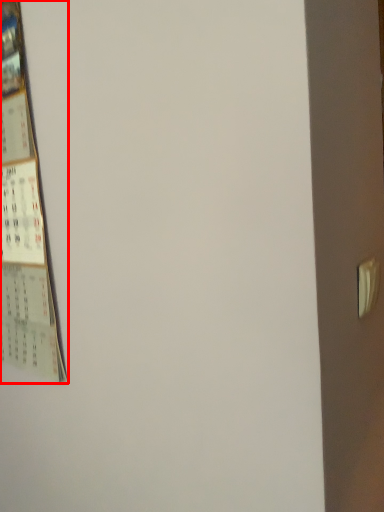
Question: From the image's perspective, where is poster (annotated by the red box) located in relation to door handle in the image?

Choices:
 (A) below
 (B) above

Answer: (B)